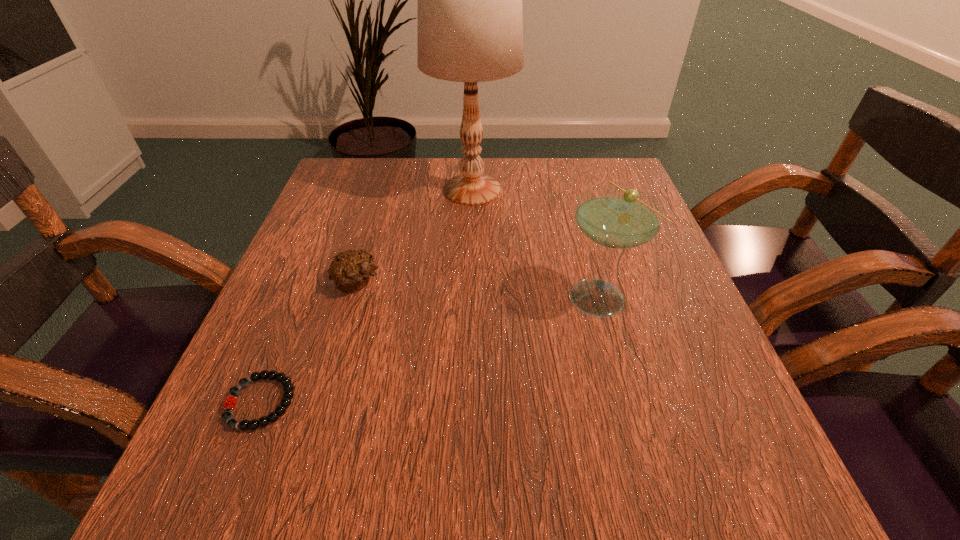
This screenshot has width=960, height=540. What are the coordinates of `free space located 0.360m on the back of the nearest object` in the screenshot? It's located at (330, 232).

You are a GUI agent. You are given a task and a screenshot of the screen. Output one action in this format:
    pyautogui.click(x=<x>, y=<y>)
    Task: Click on the object located in the far edge section of the desktop
    The width and height of the screenshot is (960, 540).
    Given the screenshot: What is the action you would take?
    pyautogui.click(x=470, y=23)

This screenshot has width=960, height=540. What are the coordinates of `muffin that is at the left edge` in the screenshot? It's located at (350, 270).

This screenshot has width=960, height=540. Identify the location of bracelet located at the left edge. (229, 403).

The image size is (960, 540). I want to click on object located in the right edge section of the desktop, so click(x=615, y=217).

Locate an element on the screen. free space at the far edge is located at coordinates (426, 186).

Identify the location of free spot at the near edge of the desktop. point(394,488).

At what (x,y) coordinates should I click in order to perform the action: click on vacant space at the left edge of the desktop. Please return your answer as a coordinate pair (x, y). Looking at the image, I should click on (358, 302).

In order to click on free spot at the near left corner of the desktop in this screenshot , I will do `click(192, 468)`.

The image size is (960, 540). I want to click on vacant area at the far right corner, so click(621, 181).